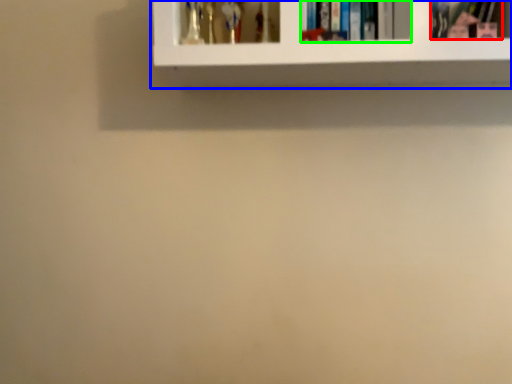
Question: Based on their relative distances, which object is farther from book (highlighted by a red box)? Choose from shelf (highlighted by a blue box) and book (highlighted by a green box).

Choices:
 (A) shelf
 (B) book

Answer: (A)